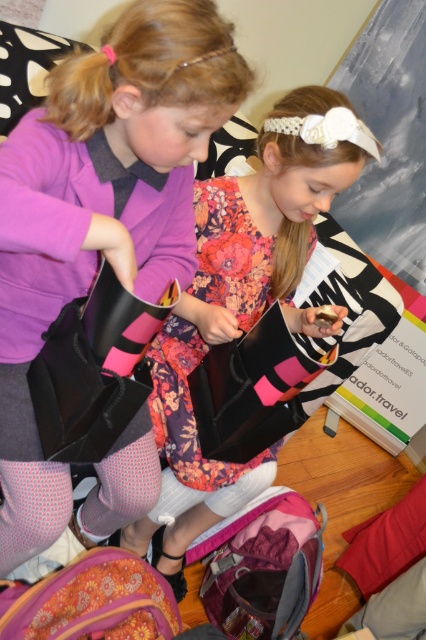
Question: Does matte black bag at center have a greater width compared to floral fabric dress at center?

Choices:
 (A) no
 (B) yes

Answer: (A)

Question: Is matte black bag at center further to the viewer compared to floral fabric dress at center?

Choices:
 (A) no
 (B) yes

Answer: (A)

Question: Among these objects, which one is nearest to the camera?

Choices:
 (A) floral fabric dress at center
 (B) matte black bag at center

Answer: (B)

Question: Which of the following is the closest to the observer?

Choices:
 (A) floral fabric dress at center
 (B) matte black bag at center

Answer: (B)

Question: Which of the following is the closest to the observer?

Choices:
 (A) (374, 145)
 (B) (45, 296)

Answer: (B)

Question: Is matte black bag at center wider than floral fabric dress at center?

Choices:
 (A) yes
 (B) no

Answer: (B)